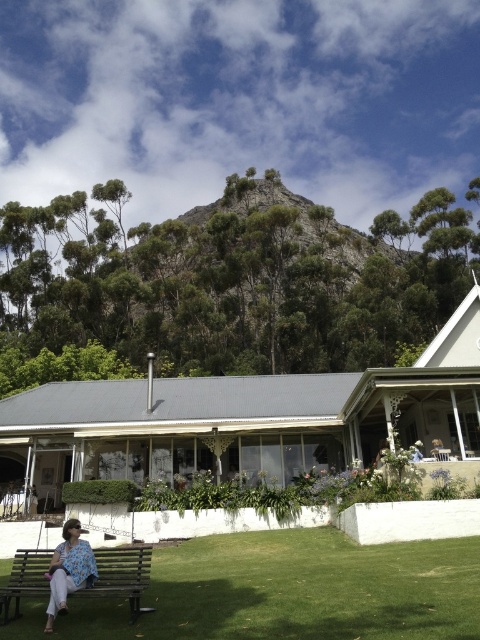
Who is lower down, green grass at lower left or wooden bench at lower left?

green grass at lower left is lower down.

Can you confirm if green grass at lower left is positioned above wooden bench at lower left?

Incorrect, green grass at lower left is not positioned above wooden bench at lower left.

Consider the image. Who is more forward, (103,573) or (35,577)?

Positioned in front is point (103,573).

I want to click on green grass at lower left, so click(x=295, y=589).

Is wooden bench at lower left in front of floral fabric dress at lower left?

No, wooden bench at lower left is further to the viewer.

The height and width of the screenshot is (640, 480). What do you see at coordinates (122, 576) in the screenshot?
I see `wooden bench at lower left` at bounding box center [122, 576].

Locate an element on the screen. Image resolution: width=480 pixels, height=640 pixels. wooden bench at lower left is located at coordinates (122, 576).

Is green grass at lower left closer to the viewer compared to floral fabric dress at lower left?

Yes, green grass at lower left is in front of floral fabric dress at lower left.

Who is higher up, green grass at lower left or floral fabric dress at lower left?

floral fabric dress at lower left is above.

Which is in front, point (178, 616) or point (84, 573)?

Positioned in front is point (178, 616).

Where is `green grass at lower left`? This screenshot has width=480, height=640. green grass at lower left is located at coordinates (295, 589).